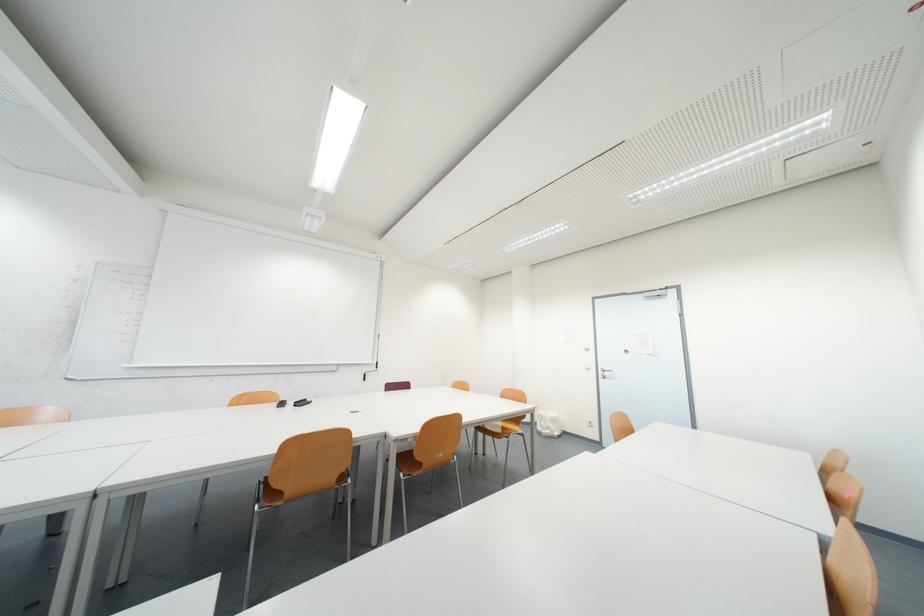
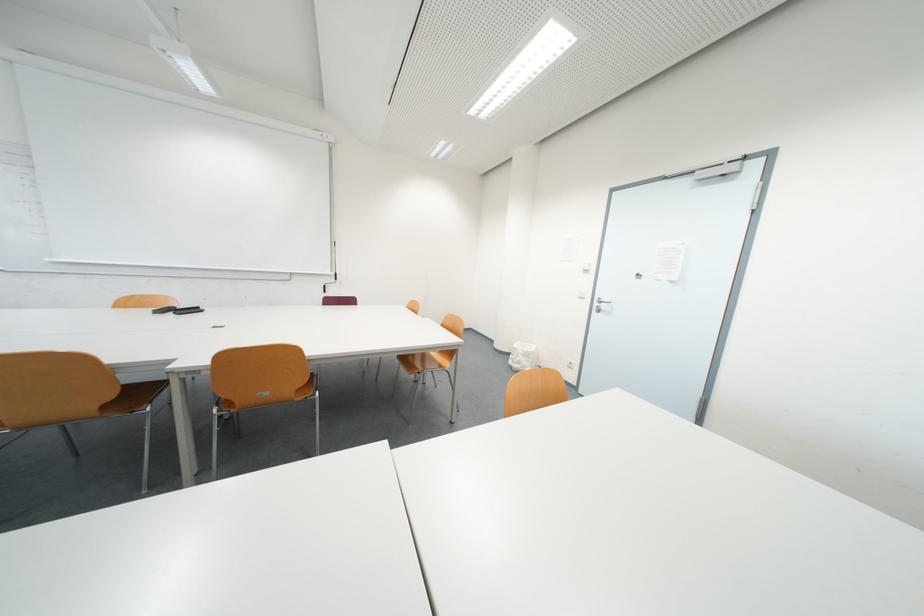
Find the pixel in the second image that matches pixel 558 429 in the first image.

(529, 363)